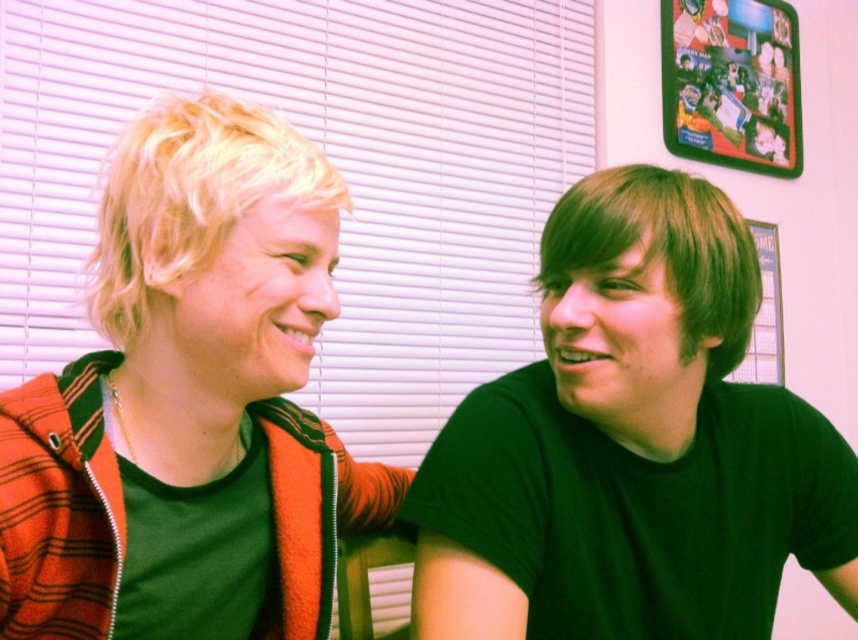
Question: Considering the relative positions of matte orange hoodie at left and green matte shirt at right in the image provided, where is matte orange hoodie at left located with respect to green matte shirt at right?

Choices:
 (A) below
 (B) above

Answer: (B)

Question: Can you confirm if matte orange hoodie at left is positioned to the left of green matte shirt at right?

Choices:
 (A) yes
 (B) no

Answer: (A)

Question: Does matte orange hoodie at left lie behind green matte shirt at right?

Choices:
 (A) yes
 (B) no

Answer: (B)

Question: Which point is farther to the camera?

Choices:
 (A) (337, 516)
 (B) (635, 452)

Answer: (A)

Question: Which of the following is the farthest from the observer?

Choices:
 (A) matte orange hoodie at left
 (B) green matte shirt at right

Answer: (B)